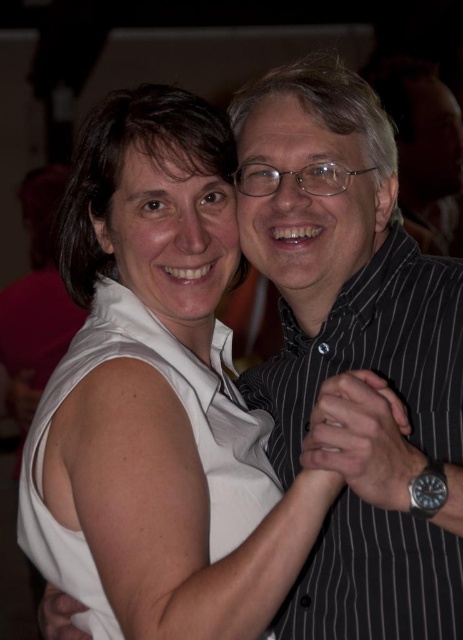
Question: Observing the image, what is the correct spatial positioning of black striped dress shirt at right in reference to white sleeveless dress at left?

Choices:
 (A) above
 (B) below

Answer: (A)

Question: Which point is closer to the camera?

Choices:
 (A) (374, 285)
 (B) (193, 432)

Answer: (B)

Question: Is black striped dress shirt at right further to camera compared to white sleeveless dress at left?

Choices:
 (A) no
 (B) yes

Answer: (A)

Question: Can you confirm if black striped dress shirt at right is smaller than white sleeveless dress at left?

Choices:
 (A) yes
 (B) no

Answer: (B)